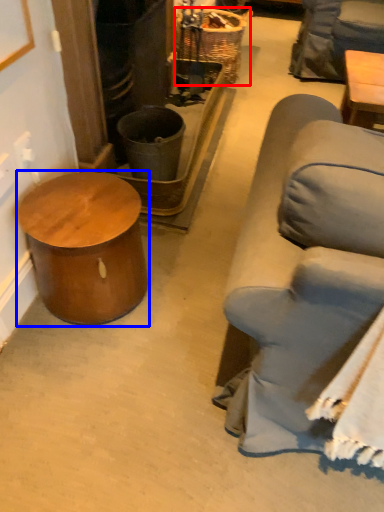
Question: Which object appears closest to the camera in this image, basket (highlighted by a red box) or table (highlighted by a blue box)?

Choices:
 (A) basket
 (B) table

Answer: (B)